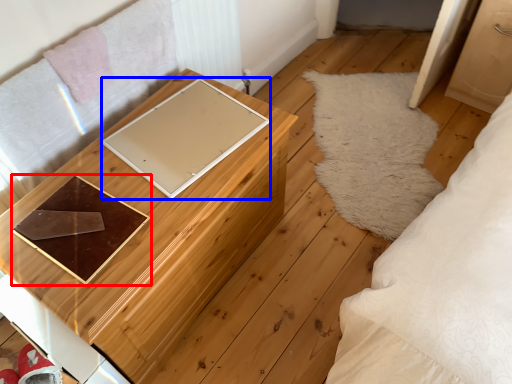
Question: Which of the following is the farthest to the observer, tray (highlighted by a red box) or pad (highlighted by a blue box)?

Choices:
 (A) tray
 (B) pad

Answer: (B)